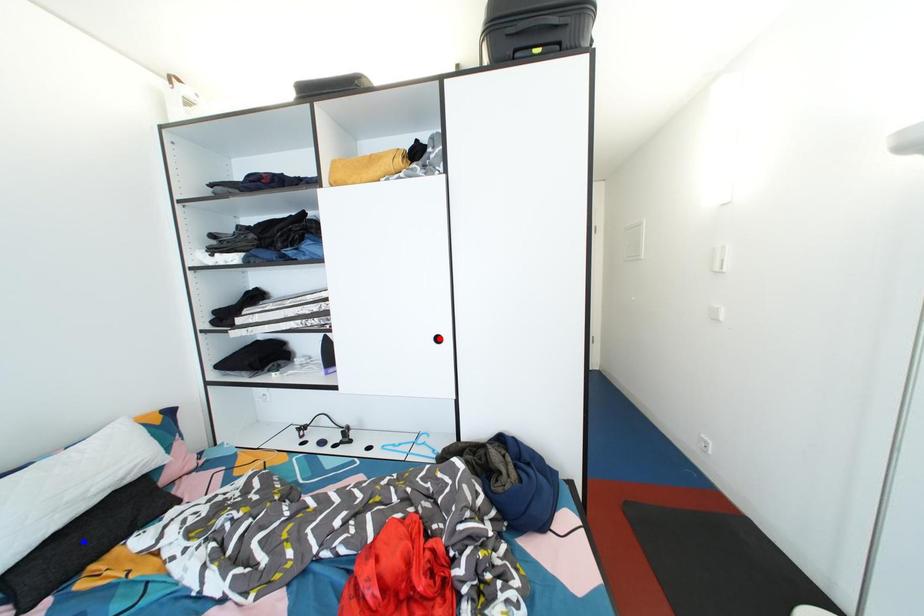
Question: In the image, two points are highlighted. Which point is nearer to the camera? Reply with the corresponding letter.

Choices:
 (A) blue point
 (B) red point

Answer: (A)